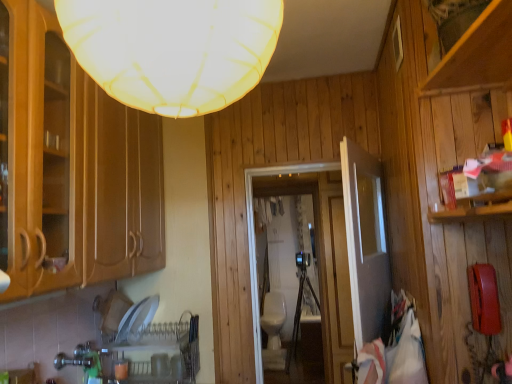
Describe the element at coordinates (73, 361) in the screenshot. I see `brushed metal faucet at lower left` at that location.

At what (x,y) coordinates should I click in order to perform the action: click on white fabric lampshade at upper center. Please return your answer as a coordinate pair (x, y). Looking at the image, I should click on (173, 49).

Measure the distance from white glossy door at center to transparent glass door at center.

The distance of white glossy door at center from transparent glass door at center is 22.04 inches.

From a real-world perspective, who is located higher, white glossy door at center or transparent glass door at center?

white glossy door at center is physically above.

From the image's perspective, is white glossy door at center positioned above or below transparent glass door at center?

white glossy door at center is above transparent glass door at center.

Between white glossy door at center and transparent glass door at center, which one appears on the left side from the viewer's perspective?

Positioned to the left is transparent glass door at center.

From a real-world perspective, who is located higher, white glossy sink at center or white fabric lampshade at upper center?

white fabric lampshade at upper center.

Does white glossy sink at center have a smaller size compared to white fabric lampshade at upper center?

Yes, white glossy sink at center is smaller than white fabric lampshade at upper center.

Is white glossy sink at center surrounding white fabric lampshade at upper center?

No, white fabric lampshade at upper center is located outside of white glossy sink at center.

How different are the orientations of transparent glass door at center and white glossy sink at center in degrees?

The angle between the facing direction of transparent glass door at center and the facing direction of white glossy sink at center is 88 degrees.

Is transparent glass door at center taller or shorter than white glossy sink at center?

Clearly, transparent glass door at center is taller compared to white glossy sink at center.

Is transparent glass door at center positioned with its back to white glossy sink at center?

No, transparent glass door at center's orientation is not away from white glossy sink at center.

Between point (258, 345) and point (301, 306), which one is positioned in front?

The point (258, 345) is closer to the camera.

Are white glossy door at center and brushed metal faucet at lower left far apart?

white glossy door at center is far away from brushed metal faucet at lower left.

Does white glossy door at center have a lesser height compared to brushed metal faucet at lower left?

In fact, white glossy door at center may be taller than brushed metal faucet at lower left.

Is the depth of white glossy door at center greater than that of brushed metal faucet at lower left?

No, white glossy door at center is closer to the camera.

Considering the points (250, 242) and (362, 199), which point is in front, point (250, 242) or point (362, 199)?

The point (362, 199) is closer.

Can white glossy door at center be found inside transparent glass door at center?

No, transparent glass door at center does not contain white glossy door at center.

How many degrees apart are the facing directions of transparent glass door at center and white glossy door at center?

There is a 71.3-degree angle between the facing directions of transparent glass door at center and white glossy door at center.

Are transparent glass door at center and white glossy door at center making contact?

No, transparent glass door at center is not making contact with white glossy door at center.

Is brushed metal faucet at lower left outside of white glossy sink at center?

Yes, brushed metal faucet at lower left is located beyond the bounds of white glossy sink at center.

Is brushed metal faucet at lower left touching white glossy sink at center?

No.

Is brushed metal faucet at lower left positioned with its back to white glossy sink at center?

brushed metal faucet at lower left is not turned away from white glossy sink at center.

Based on their sizes in the image, would you say transparent glass door at center is bigger or smaller than white fabric lampshade at upper center?

In the image, transparent glass door at center appears to be smaller than white fabric lampshade at upper center.

Is transparent glass door at center facing away from white fabric lampshade at upper center?

Yes, transparent glass door at center is facing away from white fabric lampshade at upper center.

Between transparent glass door at center and white fabric lampshade at upper center, which one appears on the left side from the viewer's perspective?

From the viewer's perspective, white fabric lampshade at upper center appears more on the left side.

From the image's perspective, is transparent glass door at center on top of white fabric lampshade at upper center?

No, from the image's perspective, transparent glass door at center is not on top of white fabric lampshade at upper center.

Identify the location of glass door directly beneath the white glossy door at center (from a real-world perspective). (255, 236).

This screenshot has width=512, height=384. I want to click on lamp on the left of the white glossy sink at center, so click(x=173, y=49).

Estimate the real-world distances between objects in this image. Which object is closer to white glossy door at center, transparent glass door at center or white glossy sink at center?

transparent glass door at center is positioned closer to the anchor white glossy door at center.

Considering their positions, is brushed metal faucet at lower left positioned further to white fabric lampshade at upper center than white glossy sink at center?

white glossy sink at center is further to white fabric lampshade at upper center.

From the image, which object appears to be farther from brushed metal faucet at lower left, white fabric lampshade at upper center or white glossy door at center?

white fabric lampshade at upper center.

Based on their spatial positions, is transparent glass door at center or white glossy sink at center closer to brushed metal faucet at lower left?

transparent glass door at center is closer to brushed metal faucet at lower left.

Which object lies further to the anchor point white fabric lampshade at upper center, white glossy sink at center or white glossy door at center?

Result: white glossy sink at center.

Estimate the real-world distances between objects in this image. Which object is closer to white glossy sink at center, white glossy door at center or brushed metal faucet at lower left?

white glossy door at center is closer to white glossy sink at center.

From the image, which object appears to be farther from white glossy sink at center, white fabric lampshade at upper center or brushed metal faucet at lower left?

Among the two, white fabric lampshade at upper center is located further to white glossy sink at center.

When comparing their distances from white glossy door at center, does white fabric lampshade at upper center or brushed metal faucet at lower left seem closer?

white fabric lampshade at upper center is positioned closer to the anchor white glossy door at center.

Identify the location of glass door between white fabric lampshade at upper center and white glossy sink at center in the front-back direction. (255, 236).

You are a GUI agent. You are given a task and a screenshot of the screen. Output one action in this format:
    pyautogui.click(x=<x>, y=<y>)
    Task: Click on the lamp between brushed metal faucet at lower left and white glossy door at center in the horizontal direction
    Image resolution: width=512 pixels, height=384 pixels.
    Given the screenshot: What is the action you would take?
    coord(173,49)

Locate an element on the screen. faucet positioned between white fabric lampshade at upper center and white glossy sink at center from near to far is located at coordinates (73, 361).

Locate an element on the screen. This screenshot has width=512, height=384. glass door between white glossy door at center and white glossy sink at center in the front-back direction is located at coordinates (255, 236).